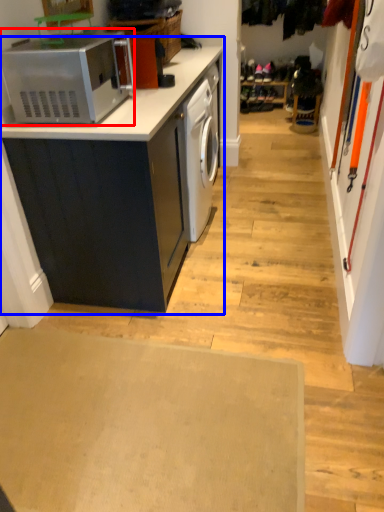
Question: Which point is closer to the camera, home appliance (highlighted by a red box) or cabinetry (highlighted by a blue box)?

Choices:
 (A) home appliance
 (B) cabinetry

Answer: (A)